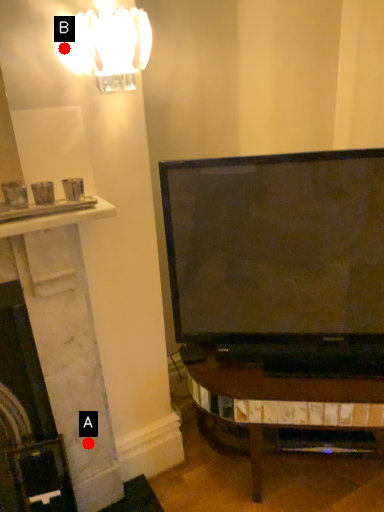
Question: Two points are circled on the image, labeled by A and B beside each circle. Which point appears farthest from the camera in this image?

Choices:
 (A) A is further
 (B) B is further

Answer: (A)